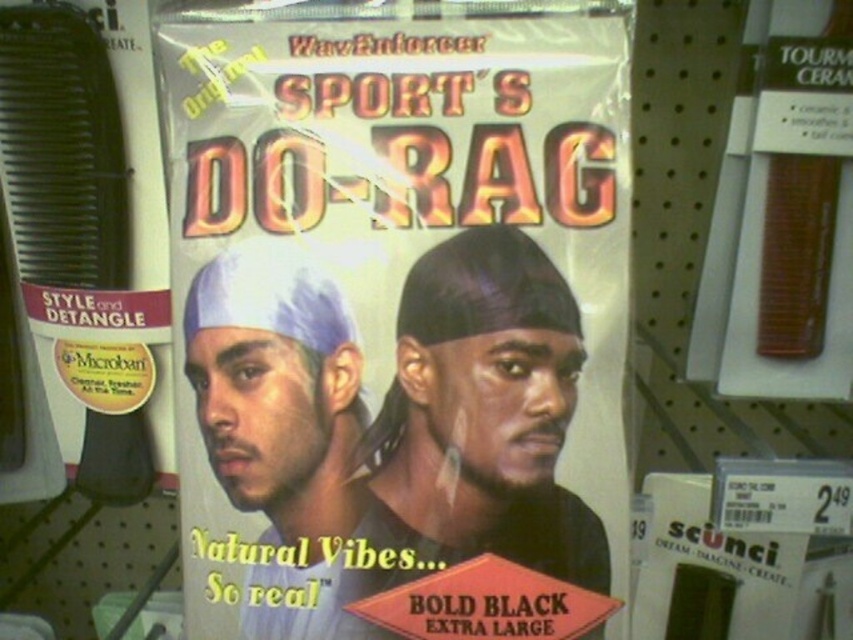
Question: Among these points, which one is farthest from the camera?

Choices:
 (A) (416, 72)
 (B) (572, 419)
 (C) (314, 474)

Answer: (A)

Question: Can you confirm if matte black do-rag at center is positioned below matte blue bandana at center?

Choices:
 (A) no
 (B) yes

Answer: (B)

Question: Can you confirm if matte black do-rag at center is positioned below matte blue bandana at center?

Choices:
 (A) yes
 (B) no

Answer: (A)

Question: Does matte black do-rag at center have a smaller size compared to matte blue bandana at center?

Choices:
 (A) yes
 (B) no

Answer: (B)

Question: Which of the following is the farthest from the observer?

Choices:
 (A) (434, 321)
 (B) (360, 365)

Answer: (B)

Question: Which is nearer to the matte blue bandana at center?

Choices:
 (A) bold black fabric do-rag at center
 (B) matte black do-rag at center

Answer: (B)